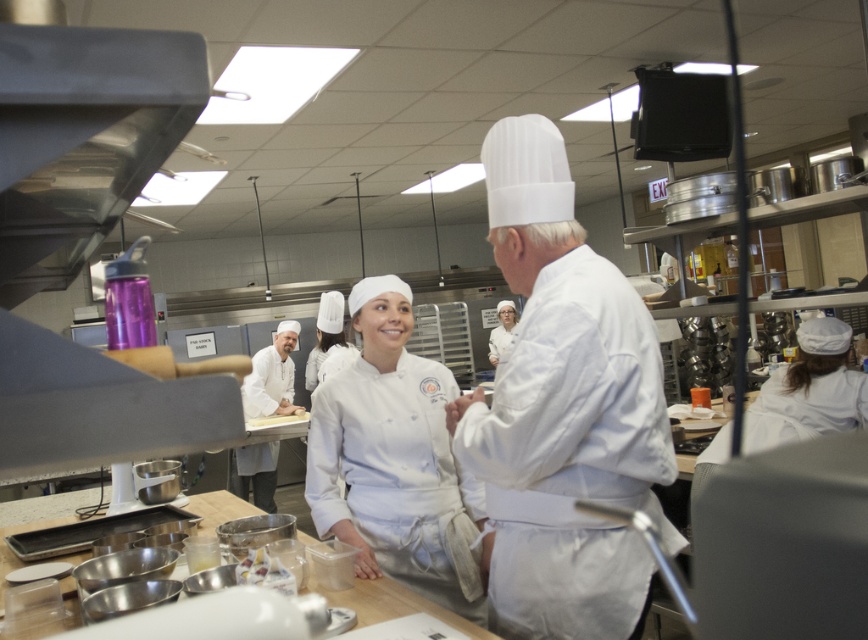
Question: Which point is closer to the camera?

Choices:
 (A) white matte chef's coat at center
 (B) white matte chef hat at center
 (C) white chef coat at center

Answer: (B)

Question: Can you confirm if white matte chef's coat at center is positioned above white chef coat at center?

Choices:
 (A) yes
 (B) no

Answer: (A)

Question: Which of these objects is positioned closest to the white matte chef's coat at center?

Choices:
 (A) white matte chef hat at center
 (B) white chef coat at center

Answer: (A)

Question: Which object is farther from the camera taking this photo?

Choices:
 (A) white matte chef hat at center
 (B) white chef coat at center
 (C) white matte chef's coat at center

Answer: (B)

Question: Does white matte chef hat at center appear on the left side of white chef coat at center?

Choices:
 (A) no
 (B) yes

Answer: (A)

Question: Does white matte chef's coat at center lie behind white chef coat at center?

Choices:
 (A) no
 (B) yes

Answer: (A)